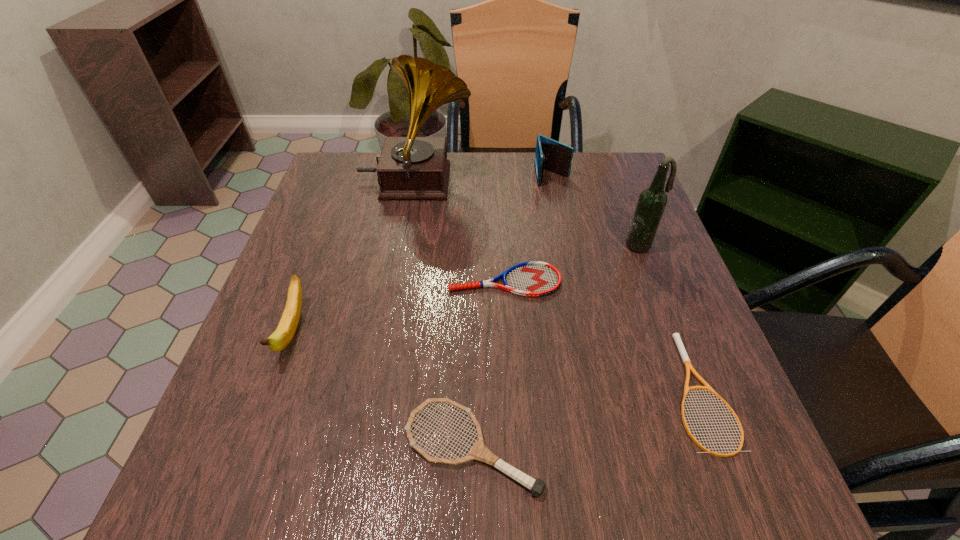
Where is `vacant space that is in between the tallest object and the leftmost object`? The height and width of the screenshot is (540, 960). vacant space that is in between the tallest object and the leftmost object is located at coordinates (354, 257).

In order to click on vacant area that lies between the tallest tennis racket and the wallet in this screenshot , I will do (x=512, y=312).

Find the location of a particular element. The height and width of the screenshot is (540, 960). empty location between the farthest tennis racket and the fifth nearest object is located at coordinates (573, 263).

This screenshot has width=960, height=540. What are the coordinates of `vacant space that is in between the leftmost object and the phonograph record` in the screenshot? It's located at (354, 257).

This screenshot has width=960, height=540. In order to click on vacant region between the leftmost object and the rightmost tennis racket in this screenshot , I will do `click(495, 361)`.

Find the location of a particular element. Image resolution: width=960 pixels, height=540 pixels. free space between the leftmost object and the tallest object is located at coordinates (354, 257).

Where is `empty space that is in between the fifth nearest object and the wallet`? empty space that is in between the fifth nearest object and the wallet is located at coordinates (597, 211).

Find the location of a particular element. The height and width of the screenshot is (540, 960). object that ranks as the fifth closest to the phonograph record is located at coordinates (676, 336).

Where is `the fifth closest object to the sixth shortest object`? the fifth closest object to the sixth shortest object is located at coordinates (479, 451).

Identify which tennis racket is the second closest to the wallet. Please provide its 2D coordinates. Your answer should be formatted as a tuple, i.e. [(x, y)], where the tuple contains the x and y coordinates of a point satisfying the conditions above.

[(676, 336)]